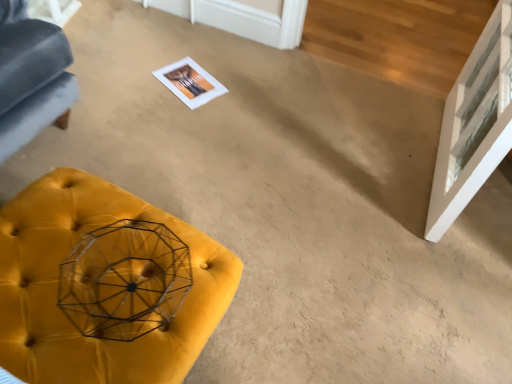
What is the approximate width of velvet yellow ottoman at lower left?

The width of velvet yellow ottoman at lower left is 20.23 inches.

The height and width of the screenshot is (384, 512). What do you see at coordinates (57, 287) in the screenshot?
I see `velvet yellow ottoman at lower left` at bounding box center [57, 287].

Locate an element on the screen. velvet yellow ottoman at lower left is located at coordinates (57, 287).

The height and width of the screenshot is (384, 512). Describe the element at coordinates (474, 124) in the screenshot. I see `transparent glass door at upper right` at that location.

The width and height of the screenshot is (512, 384). In order to click on transparent glass door at upper right in this screenshot , I will do click(474, 124).

What is the approximate width of transparent glass door at upper right?

7.16 inches.

Measure the distance between transparent glass door at upper right and camera.

A distance of 1.17 meters exists between transparent glass door at upper right and camera.

In order to face transparent glass door at upper right, should I rotate leftwards or rightwards?

You should look right and rotate roughly 26.915 degrees.

Image resolution: width=512 pixels, height=384 pixels. What are the coordinates of `velvet yellow ottoman at lower left` in the screenshot? It's located at [57, 287].

Which object is positioned more to the left, velvet yellow ottoman at lower left or transparent glass door at upper right?

velvet yellow ottoman at lower left is more to the left.

Is the depth of velvet yellow ottoman at lower left less than that of transparent glass door at upper right?

Yes, velvet yellow ottoman at lower left is closer to the viewer.

Does point (32, 241) appear closer or farther from the camera than point (449, 217)?

Point (32, 241) is positioned closer to the camera compared to point (449, 217).

From the image's perspective, between velvet yellow ottoman at lower left and transparent glass door at upper right, who is located below?

velvet yellow ottoman at lower left, from the image's perspective.

From a real-world perspective, is velvet yellow ottoman at lower left over transparent glass door at upper right?

No, from a real-world perspective, velvet yellow ottoman at lower left is not over transparent glass door at upper right

Is velvet yellow ottoman at lower left wider or thinner than transparent glass door at upper right?

velvet yellow ottoman at lower left is wider than transparent glass door at upper right.

Considering the sizes of velvet yellow ottoman at lower left and transparent glass door at upper right in the image, is velvet yellow ottoman at lower left taller or shorter than transparent glass door at upper right?

velvet yellow ottoman at lower left is shorter than transparent glass door at upper right.

Is velvet yellow ottoman at lower left bigger than transparent glass door at upper right?

No.

Do you think velvet yellow ottoman at lower left is within transparent glass door at upper right, or outside of it?

velvet yellow ottoman at lower left is not inside transparent glass door at upper right, it's outside.

Is there a large distance between velvet yellow ottoman at lower left and transparent glass door at upper right?

No.

Could you tell me if velvet yellow ottoman at lower left is turned towards transparent glass door at upper right?

Yes, velvet yellow ottoman at lower left is aimed at transparent glass door at upper right.

How much distance is there between velvet yellow ottoman at lower left and transparent glass door at upper right?

The distance of velvet yellow ottoman at lower left from transparent glass door at upper right is 38.76 inches.

Where is `furniture to the left of transparent glass door at upper right`? The width and height of the screenshot is (512, 384). furniture to the left of transparent glass door at upper right is located at coordinates (57, 287).

Considering the relative positions of transparent glass door at upper right and velvet yellow ottoman at lower left in the image provided, is transparent glass door at upper right to the right of velvet yellow ottoman at lower left from the viewer's perspective?

Yes, transparent glass door at upper right is to the right of velvet yellow ottoman at lower left.

Is transparent glass door at upper right further to camera compared to velvet yellow ottoman at lower left?

That is True.

Does point (459, 159) come in front of point (68, 356)?

No, (459, 159) is further to viewer.

From the image's perspective, between transparent glass door at upper right and velvet yellow ottoman at lower left, who is located below?

From the image's view, velvet yellow ottoman at lower left is below.

From a real-world perspective, is transparent glass door at upper right above or below velvet yellow ottoman at lower left?

From a real-world perspective, transparent glass door at upper right is physically above velvet yellow ottoman at lower left.

Is transparent glass door at upper right thinner than velvet yellow ottoman at lower left?

Indeed, transparent glass door at upper right has a lesser width compared to velvet yellow ottoman at lower left.

Can you confirm if transparent glass door at upper right is shorter than velvet yellow ottoman at lower left?

Incorrect, the height of transparent glass door at upper right does not fall short of that of velvet yellow ottoman at lower left.

Does transparent glass door at upper right have a larger size compared to velvet yellow ottoman at lower left?

Yes.

Is transparent glass door at upper right inside or outside of velvet yellow ottoman at lower left?

transparent glass door at upper right is not enclosed by velvet yellow ottoman at lower left.

Are transparent glass door at upper right and velvet yellow ottoman at lower left far apart?

transparent glass door at upper right is near velvet yellow ottoman at lower left, not far away.

Consider the image. Is velvet yellow ottoman at lower left at the back of transparent glass door at upper right?

No, velvet yellow ottoman at lower left is not at the back of transparent glass door at upper right.

Where is `furniture below the transparent glass door at upper right (from the image's perspective)`? The height and width of the screenshot is (384, 512). furniture below the transparent glass door at upper right (from the image's perspective) is located at coordinates (57, 287).

Image resolution: width=512 pixels, height=384 pixels. I want to click on glass door lying behind the velvet yellow ottoman at lower left, so click(474, 124).

Where is `furniture that appears below the transparent glass door at upper right (from a real-world perspective)`? furniture that appears below the transparent glass door at upper right (from a real-world perspective) is located at coordinates (57, 287).